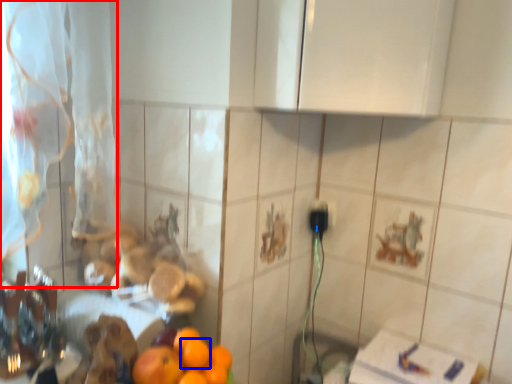
Question: Which object is further to the camera taking this photo, curtain (highlighted by a red box) or orange (highlighted by a blue box)?

Choices:
 (A) curtain
 (B) orange

Answer: (B)